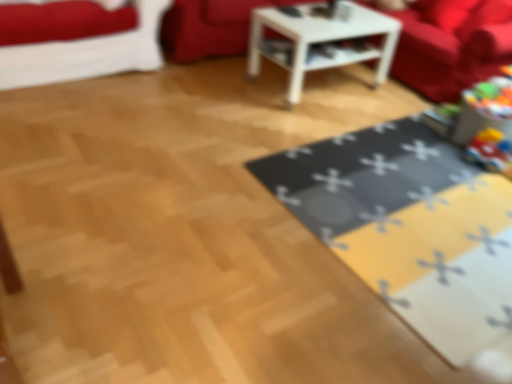
You are a GUI agent. You are given a task and a screenshot of the screen. Output one action in this format:
    pyautogui.click(x=<x>, y=<y>)
    Task: Click on the vacant point to the right of velvet red couch at upper left
    The height and width of the screenshot is (384, 512).
    Given the screenshot: What is the action you would take?
    pyautogui.click(x=189, y=91)